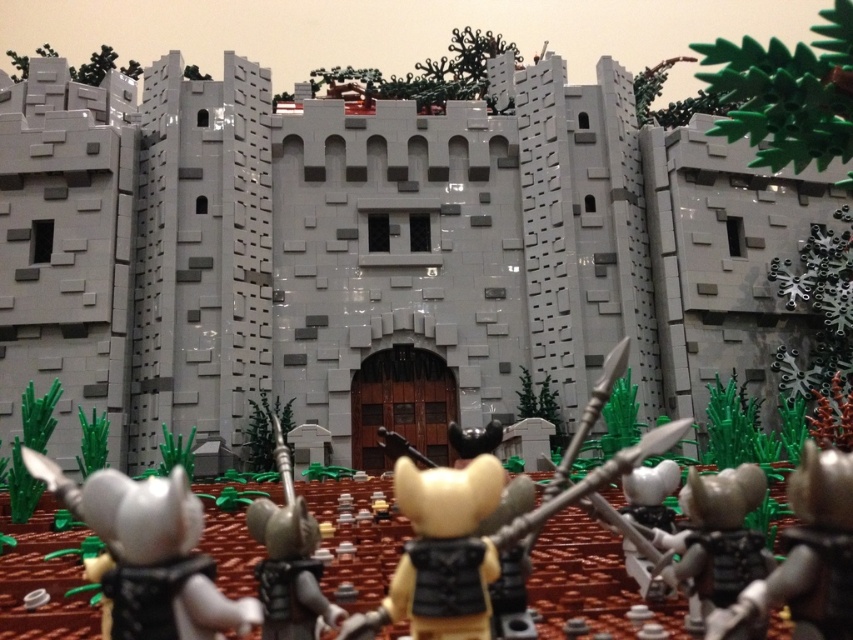
Question: Which of the following is the farthest from the observer?

Choices:
 (A) (256, 605)
 (B) (762, 589)
 (C) (314, 548)

Answer: (C)

Question: From the image, what is the correct spatial relationship of metallic silver armor at lower right in relation to metallic silver spear at center?

Choices:
 (A) below
 (B) above

Answer: (A)

Question: Is white matte axe at lower left above metallic silver armor at lower right?

Choices:
 (A) no
 (B) yes

Answer: (B)

Question: Estimate the real-world distances between objects in this image. Which object is closer to the white matte axe at lower left?

Choices:
 (A) metallic silver armor at lower right
 (B) metallic silver spear at center

Answer: (B)

Question: Among these objects, which one is farthest from the camera?

Choices:
 (A) metallic silver spear at center
 (B) white matte axe at lower left

Answer: (A)

Question: Observing the image, what is the correct spatial positioning of metallic silver armor at lower right in reference to metallic silver spear at center?

Choices:
 (A) above
 (B) below

Answer: (B)